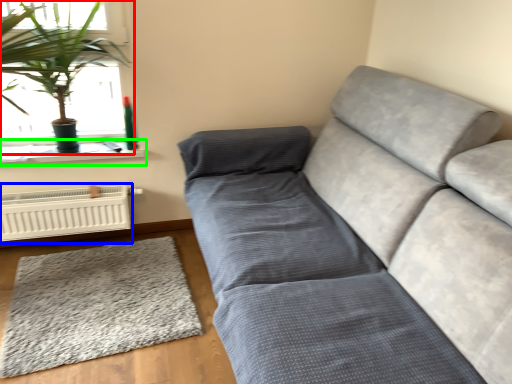
Question: Which object is positioned closest to houseplant (highlighted by a red box)? Select from heater (highlighted by a blue box) and window sill (highlighted by a green box).

Choices:
 (A) heater
 (B) window sill

Answer: (B)